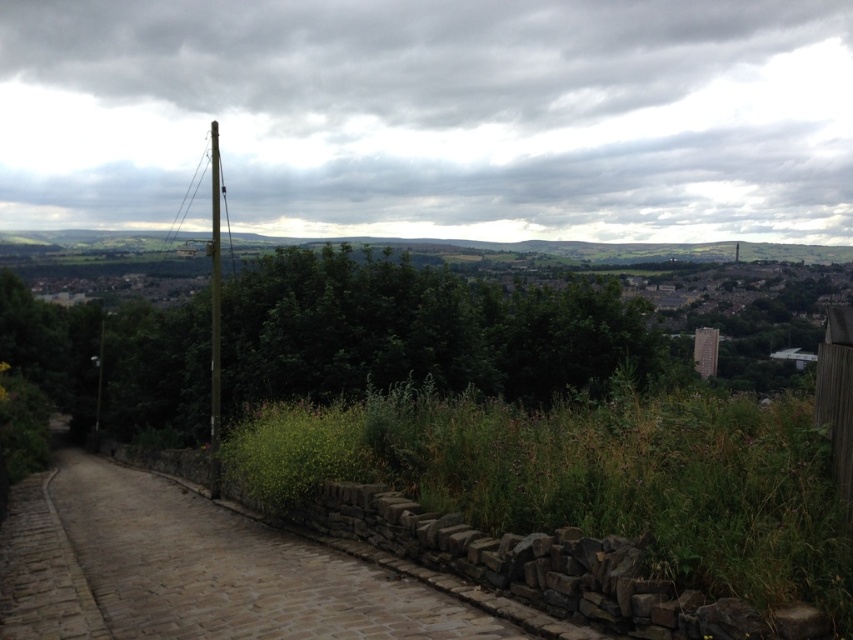
Between green leafy tree at center and brown cobblestone path at lower left, which one is positioned higher?

green leafy tree at center is above.

Is point (310, 282) positioned before point (328, 550)?

No, it is behind (328, 550).

Between point (264, 362) and point (26, 620), which one is positioned behind?

The point (264, 362) is behind.

Find the location of a particular element. Image resolution: width=853 pixels, height=640 pixels. green leafy tree at center is located at coordinates (416, 330).